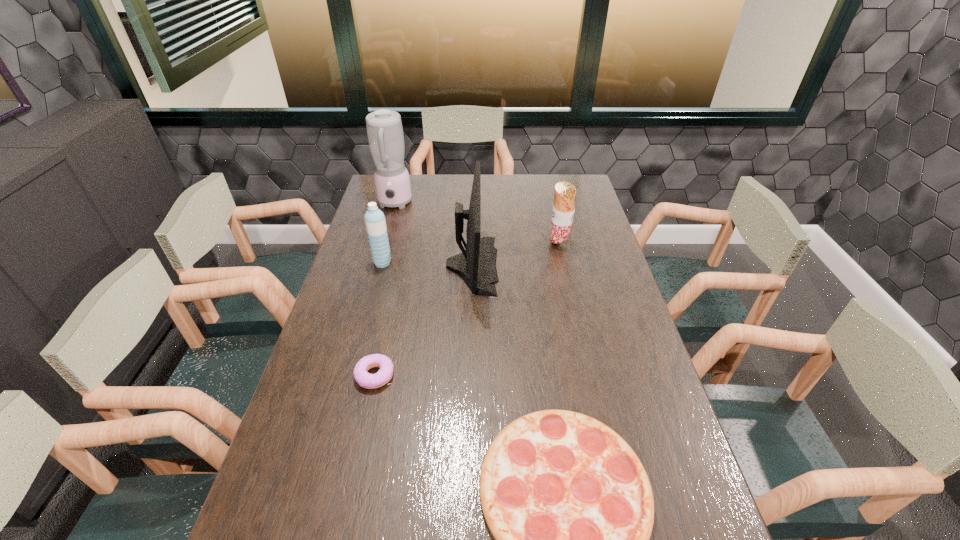
I want to click on the farthest object, so click(x=385, y=135).

The height and width of the screenshot is (540, 960). Find the location of `the tallest object`. the tallest object is located at coordinates (385, 135).

I want to click on the second tallest object, so click(476, 265).

You are a GUI agent. You are given a task and a screenshot of the screen. Output one action in this format:
    pyautogui.click(x=<x>, y=<y>)
    Task: Click on the burrito
    
    Given the screenshot: What is the action you would take?
    pyautogui.click(x=563, y=210)

In order to click on water bottle in this screenshot , I will do `click(374, 219)`.

Locate an element on the screen. doughnut is located at coordinates (366, 380).

You are a GUI agent. You are given a task and a screenshot of the screen. Output one action in this format:
    pyautogui.click(x=<x>, y=<y>)
    Task: Click on the fifth farthest object
    This screenshot has width=960, height=540.
    Given the screenshot: What is the action you would take?
    pyautogui.click(x=366, y=380)

Where is `vacant space located on the base of the tallest object near the control knob`? The image size is (960, 540). vacant space located on the base of the tallest object near the control knob is located at coordinates click(375, 271).

I want to click on vacant position located 0.170m on the screen side of the monitor, so [547, 265].

Identify the location of vacant space located 0.180m on the front of the burrito. (567, 284).